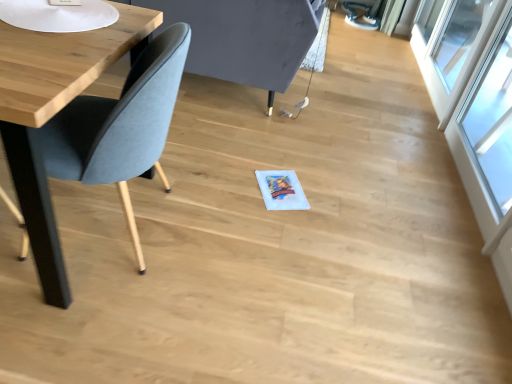
Question: Are transparent glass window at upper right, acting as the second window starting from the front, and transparent glass window at right, which is the first window in front-to-back order, far apart?

Choices:
 (A) yes
 (B) no

Answer: (B)

Question: Considering the relative sizes of transparent glass window at upper right, acting as the second window starting from the front, and transparent glass window at right, which is the first window in front-to-back order, in the image provided, is transparent glass window at upper right, acting as the second window starting from the front, smaller than transparent glass window at right, which is the first window in front-to-back order,?

Choices:
 (A) no
 (B) yes

Answer: (A)

Question: Is transparent glass window at upper right, acting as the second window starting from the front, bigger than transparent glass window at right, marked as the second window in a back-to-front arrangement?

Choices:
 (A) no
 (B) yes

Answer: (B)

Question: From a real-world perspective, does transparent glass window at upper right, acting as the second window starting from the front, stand above transparent glass window at right, marked as the second window in a back-to-front arrangement?

Choices:
 (A) no
 (B) yes

Answer: (A)

Question: Is transparent glass window at upper right, acting as the second window starting from the front, next to transparent glass window at right, marked as the second window in a back-to-front arrangement?

Choices:
 (A) no
 (B) yes

Answer: (A)

Question: Looking at their shapes, would you say transparent glass window at upper right, acting as the second window starting from the front, is wider or thinner than transparent glass window at right, marked as the second window in a back-to-front arrangement?

Choices:
 (A) thin
 (B) wide

Answer: (A)

Question: Considering the positions of point (496, 6) and point (484, 76), is point (496, 6) closer or farther from the camera than point (484, 76)?

Choices:
 (A) farther
 (B) closer

Answer: (B)

Question: From the image's perspective, relative to transparent glass window at right, which is the first window in front-to-back order, is transparent glass window at upper right, acting as the second window starting from the front, above or below?

Choices:
 (A) above
 (B) below

Answer: (A)

Question: Considering their positions, is transparent glass window at upper right, which is the 1th window from back to front, located in front of or behind transparent glass window at right, which is the first window in front-to-back order?

Choices:
 (A) behind
 (B) front

Answer: (A)

Question: In terms of width, does transparent glass window at right, which is the first window in front-to-back order, look wider or thinner when compared to transparent glass window at upper right, acting as the second window starting from the front?

Choices:
 (A) thin
 (B) wide

Answer: (B)

Question: Considering their positions, is transparent glass window at right, marked as the second window in a back-to-front arrangement, located in front of or behind transparent glass window at upper right, acting as the second window starting from the front?

Choices:
 (A) behind
 (B) front

Answer: (B)

Question: Considering the positions of transparent glass window at right, marked as the second window in a back-to-front arrangement, and transparent glass window at upper right, acting as the second window starting from the front, in the image, is transparent glass window at right, marked as the second window in a back-to-front arrangement, bigger or smaller than transparent glass window at upper right, acting as the second window starting from the front,?

Choices:
 (A) small
 (B) big

Answer: (A)

Question: Is transparent glass window at right, which is the first window in front-to-back order, taller or shorter than transparent glass window at upper right, acting as the second window starting from the front?

Choices:
 (A) tall
 (B) short

Answer: (B)

Question: Relative to soft gray fabric swivel chair at left, is transparent glass window at upper right, acting as the second window starting from the front, in front or behind?

Choices:
 (A) front
 (B) behind

Answer: (B)

Question: Based on their positions, is transparent glass window at upper right, acting as the second window starting from the front, located to the left or right of soft gray fabric swivel chair at left?

Choices:
 (A) right
 (B) left

Answer: (A)